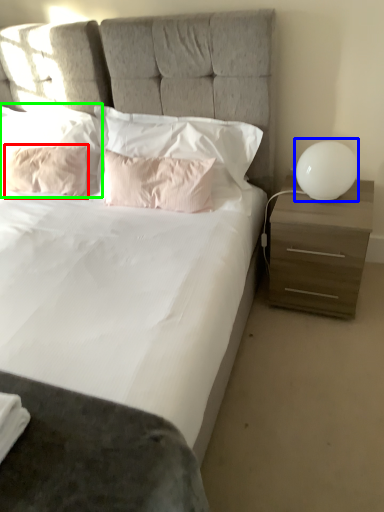
Question: Considering the real-world distances, which object is closest to pillow (highlighted by a red box)? table lamp (highlighted by a blue box) or pillow (highlighted by a green box).

Choices:
 (A) table lamp
 (B) pillow

Answer: (B)